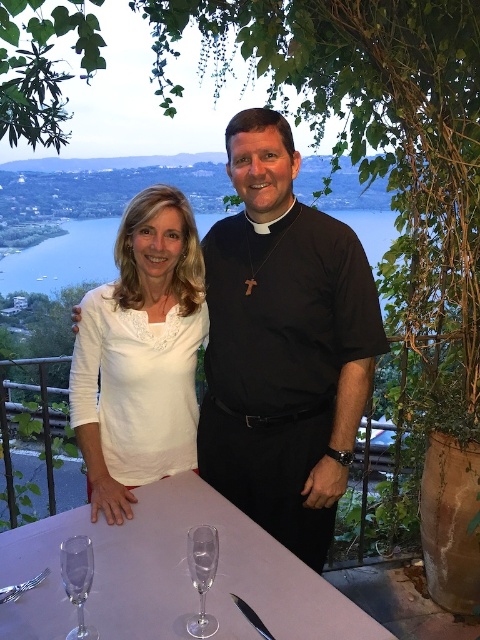
You are a waiter at a lakeside restaurant. You need to choose a wine glass that is less likely to tip over for the guests. Which one should you choose between the clear glass wine glass at center and the clear glass wine glass at lower left?

The clear glass wine glass at lower left is thicker than the clear glass wine glass at center, so it is less likely to tip over and should be chosen.

You are a guest at this outdoor event and want to reach the clear glassware at center to get a drink. Considering the table is between you and the glassware, which direction should you move to access it?

The clear glassware at center is located at point (171, 576), so you should move towards the center of the table to reach it.